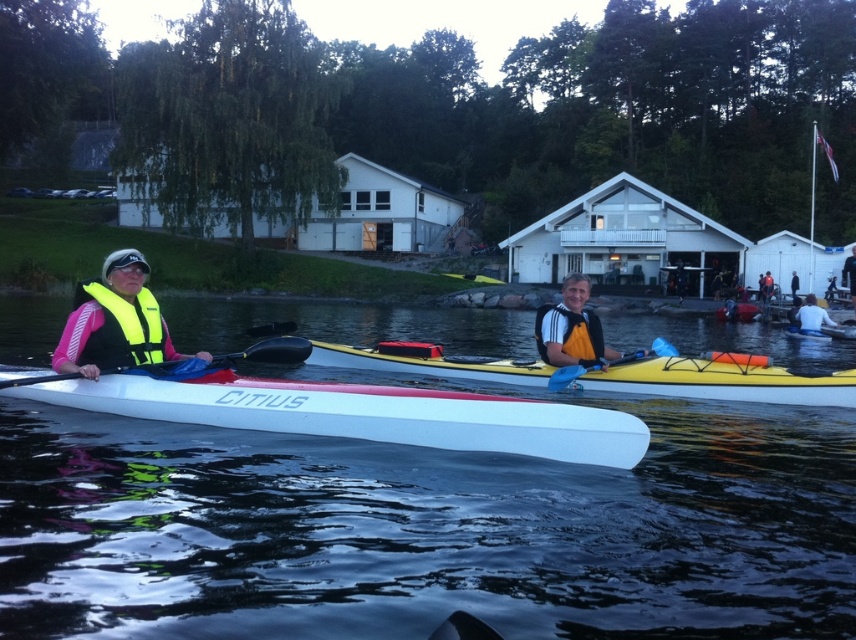
Between yellow life vest at left and black plastic paddle at left, which one appears on the right side from the viewer's perspective?

Positioned to the right is black plastic paddle at left.

Is yellow life vest at left to the right of black plastic paddle at left from the viewer's perspective?

No, yellow life vest at left is not to the right of black plastic paddle at left.

Which is behind, point (123, 280) or point (292, 349)?

Positioned behind is point (123, 280).

The height and width of the screenshot is (640, 856). I want to click on yellow life vest at left, so click(116, 321).

Is the position of white glossy kayak at left less distant than that of blue plastic paddle at center?

Yes, white glossy kayak at left is in front of blue plastic paddle at center.

Between point (155, 589) and point (597, 364), which one is positioned in front?

Point (155, 589) is more forward.

Between point (385, 540) and point (580, 371), which one is positioned behind?

The point (580, 371) is more distant.

I want to click on white glossy kayak at left, so click(x=426, y=531).

Between point (403, 388) and point (134, 356), which one is positioned in front?

Point (403, 388)

How much distance is there between white matte canoe at center and yellow fabric life jacket at left?

white matte canoe at center is 3.76 feet from yellow fabric life jacket at left.

The image size is (856, 640). What do you see at coordinates (340, 406) in the screenshot?
I see `white matte canoe at center` at bounding box center [340, 406].

Where is `white matte canoe at center`? The width and height of the screenshot is (856, 640). white matte canoe at center is located at coordinates (340, 406).